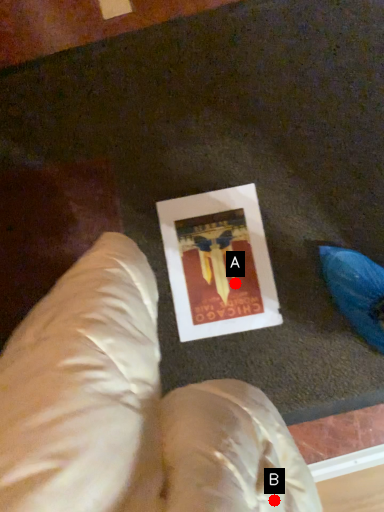
Question: Two points are circled on the image, labeled by A and B beside each circle. Which point appears farthest from the camera in this image?

Choices:
 (A) A is further
 (B) B is further

Answer: (A)